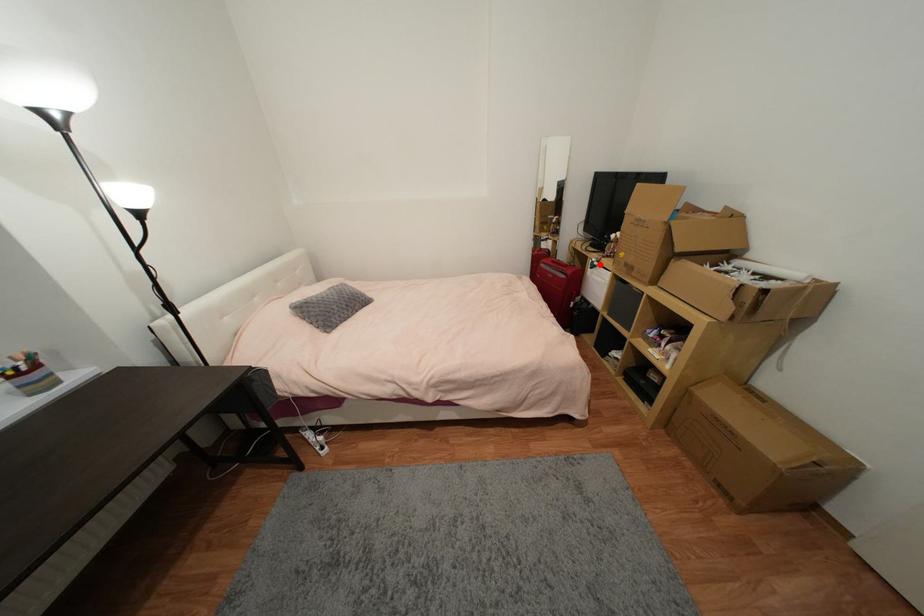
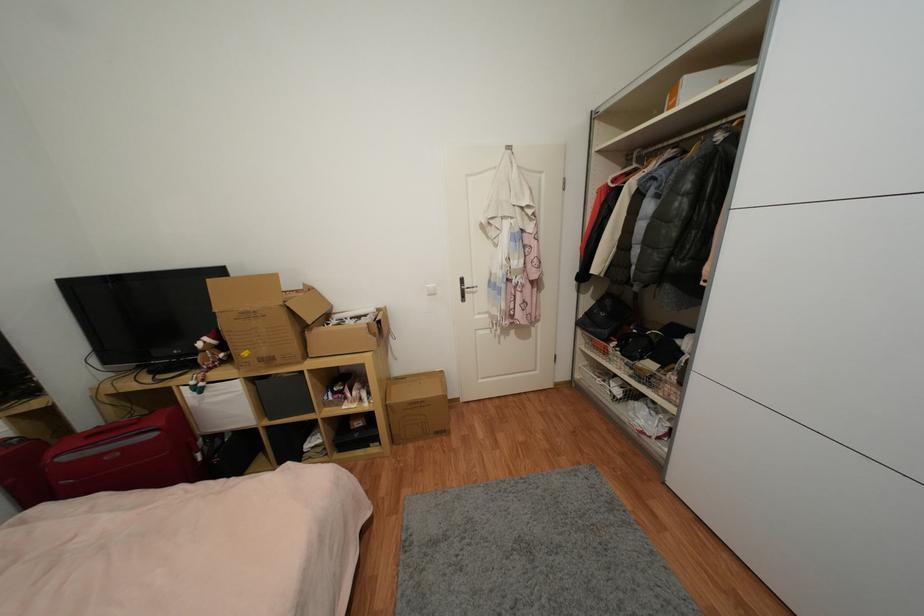
Locate, in the second image, the point that corresponds to the highlighted location in the first image.

(205, 386)